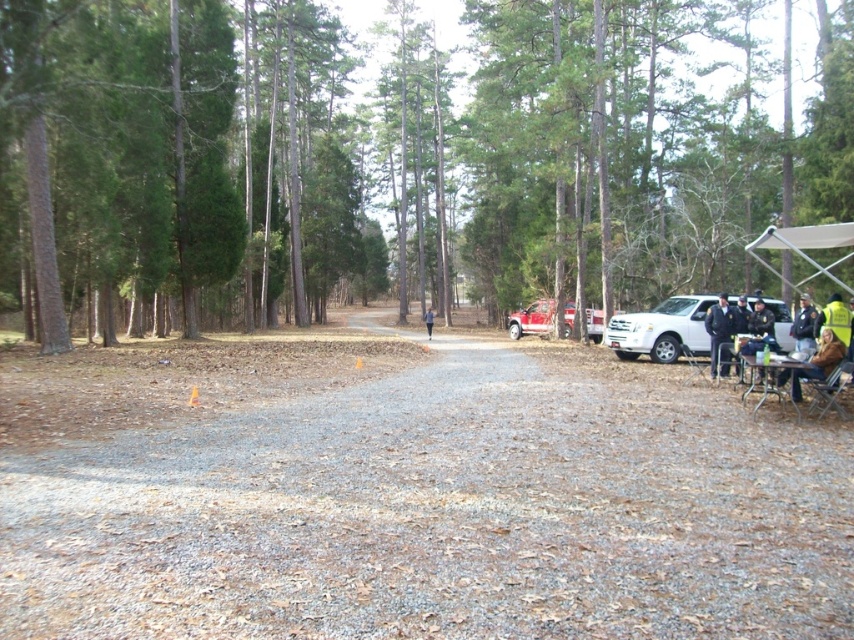
You are a hiker standing at the start of the gravel path and want to reach the person walking away. There is a white matte suv at right and a dark blue uniform at right in your way. Which object should you move around to stay on the path?

You should move around the white matte suv at right because it is positioned on the left side of the dark blue uniform at right, so going around the suv would keep you on the correct path direction.

You are a delivery driver who needs to park the matte red truck at center in a parking spot that is the same size as the yellow reflective vest at right. Based on the scene, will the truck fit in the parking spot?

The matte red truck at center has a lesser width compared to the yellow reflective vest at right, so the truck will fit in the parking spot since it is narrower than the vest, implying the parking space is sufficiently wide.